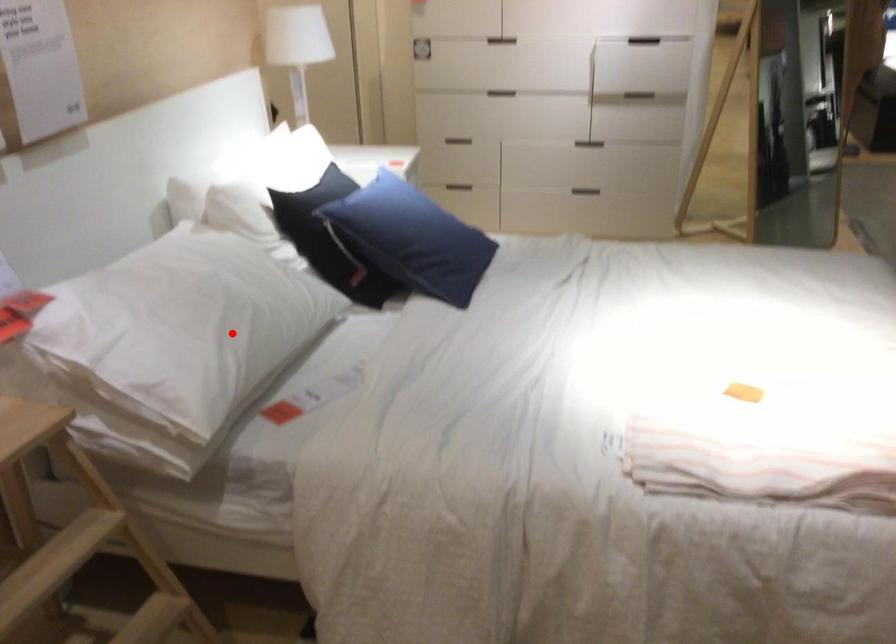
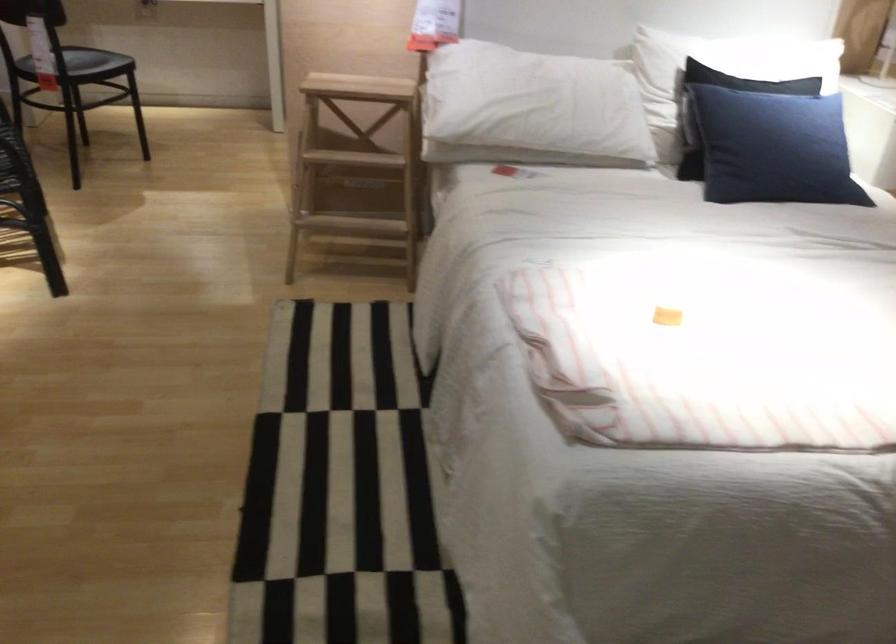
Question: I am providing you with two images of the same scene from different viewpoints. Given a red point in image1, look at the same physical point in image2. Is it:

Choices:
 (A) Closer to the viewpoint
 (B) Farther from the viewpoint

Answer: (B)